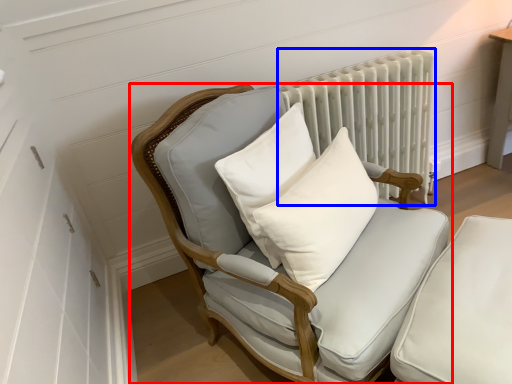
Question: Which object appears farthest to the camera in this image, chair (highlighted by a red box) or radiator (highlighted by a blue box)?

Choices:
 (A) chair
 (B) radiator

Answer: (B)